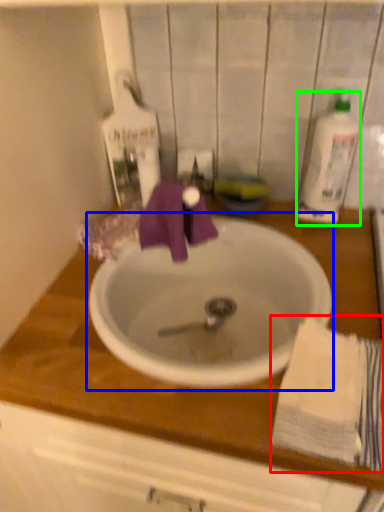
Question: Which object is the closest to the bath towel (highlighted by a red box)? Choose among these: sink (highlighted by a blue box) or cleaning product (highlighted by a green box).

Choices:
 (A) sink
 (B) cleaning product

Answer: (A)